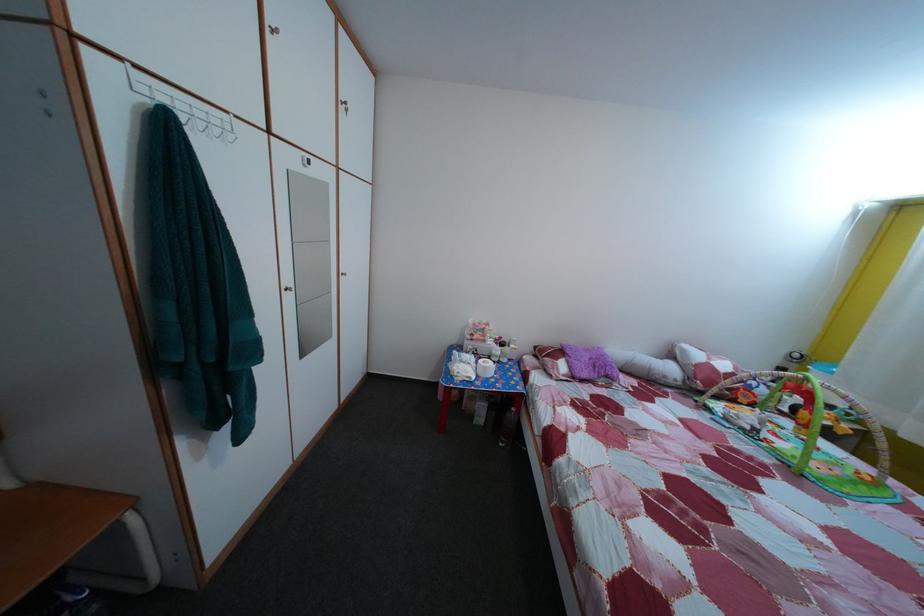
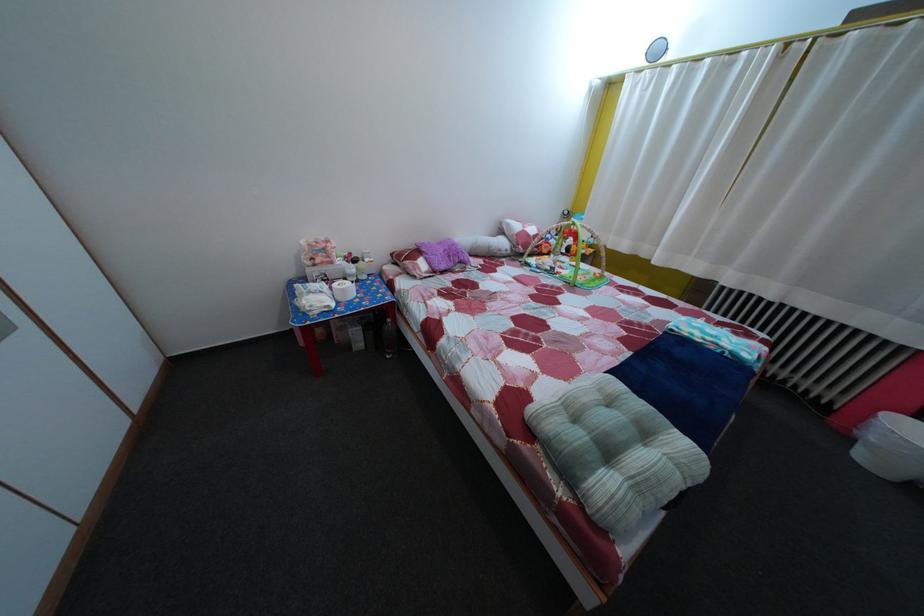
The point at (485, 359) is marked in the first image. Where is the corresponding point in the second image?

(335, 284)